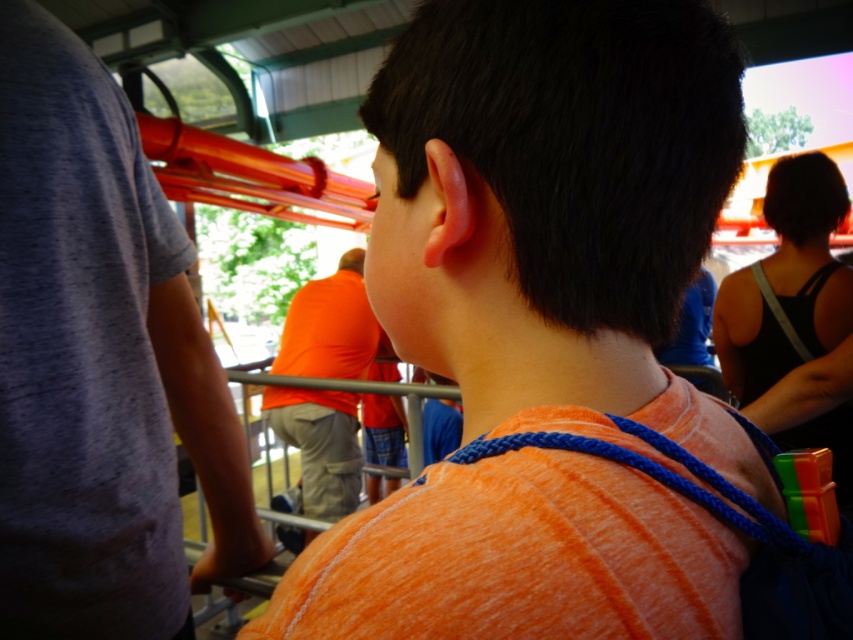
You are inside a moving train and want to take a photo of the two points marked in the scene. Which point, point (27, 580) or point (334, 314), will appear larger in your photo?

Point (27, 580) is closer to the camera than point (334, 314), so it will appear larger in the photo.